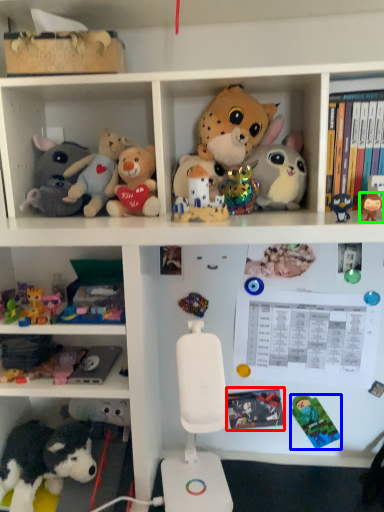
Question: Based on their relative distances, which object is farther from book (highlighted by a red box)? Choose from toy (highlighted by a blue box) and toy (highlighted by a green box).

Choices:
 (A) toy
 (B) toy

Answer: (B)